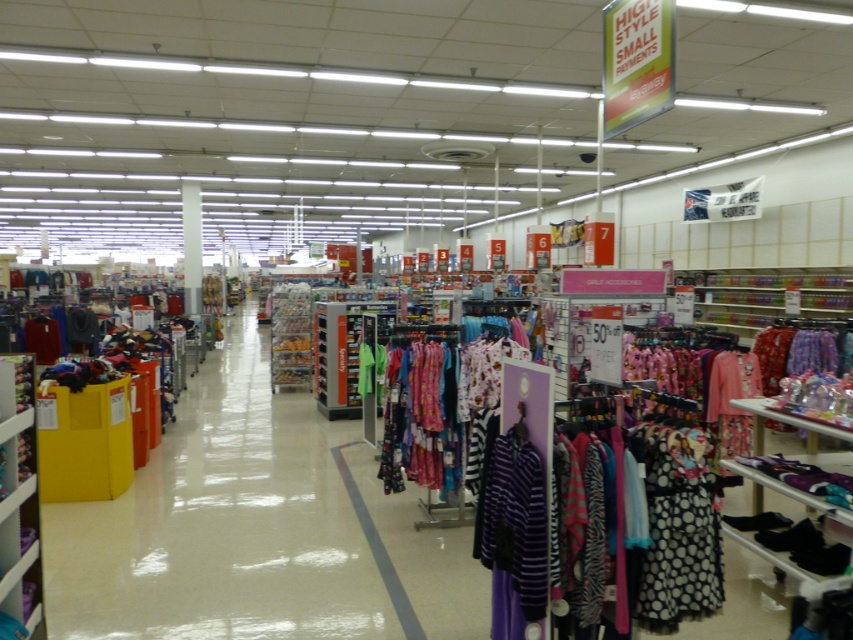
Can you confirm if matte plastic clothing rack at center is positioned above printed cotton pajamas at center?

Actually, matte plastic clothing rack at center is below printed cotton pajamas at center.

Is point (96, 589) more distant than point (438, 428)?

No, it is in front of (438, 428).

Locate an element on the screen. The image size is (853, 640). matte plastic clothing rack at center is located at coordinates (228, 524).

Identify the location of matte plastic clothing rack at center. This screenshot has height=640, width=853. (228, 524).

Who is positioned more to the right, matte plastic shelf at lower left or printed cotton pajamas at center?

printed cotton pajamas at center

Between point (15, 410) and point (467, 397), which one is positioned behind?

Positioned behind is point (467, 397).

At what (x,y) coordinates should I click in order to perform the action: click on matte plastic shelf at lower left. Please return your answer as a coordinate pair (x, y). Image resolution: width=853 pixels, height=640 pixels. Looking at the image, I should click on pyautogui.click(x=18, y=496).

Who is more forward, (165, 515) or (514, 536)?

Point (514, 536) is more forward.

Is matte plastic clothing rack at center to the right of purple striped shirt at lower center from the viewer's perspective?

No, matte plastic clothing rack at center is not to the right of purple striped shirt at lower center.

Which is behind, point (395, 589) or point (492, 452)?

The point (395, 589) is behind.

Identify the location of matte plastic clothing rack at center. This screenshot has height=640, width=853. (228, 524).